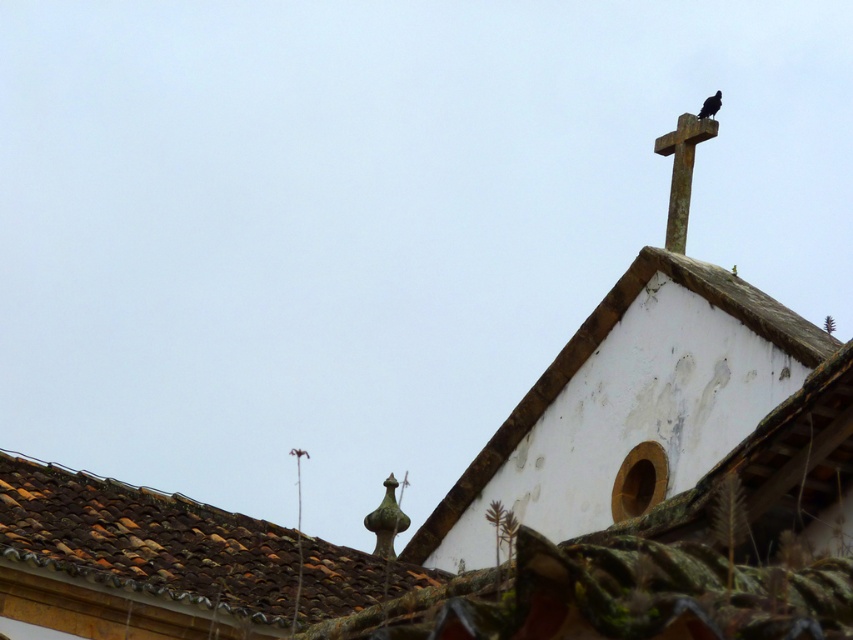
Question: Which object appears closest to the camera in this image?

Choices:
 (A) black matte bird at upper right
 (B) smooth stone cross at upper right
 (C) brown clay tiles at upper left

Answer: (C)

Question: Does smooth stone cross at upper right lie behind black matte bird at upper right?

Choices:
 (A) yes
 (B) no

Answer: (B)

Question: Which point is closer to the camera?

Choices:
 (A) (131, 625)
 (B) (715, 97)

Answer: (A)

Question: Can you confirm if smooth stone cross at upper right is wider than black matte bird at upper right?

Choices:
 (A) yes
 (B) no

Answer: (A)

Question: Among these objects, which one is nearest to the camera?

Choices:
 (A) brown clay tiles at upper left
 (B) smooth stone cross at upper right
 (C) black matte bird at upper right

Answer: (A)

Question: Can you confirm if brown clay tiles at upper left is positioned to the right of black matte bird at upper right?

Choices:
 (A) yes
 (B) no

Answer: (B)